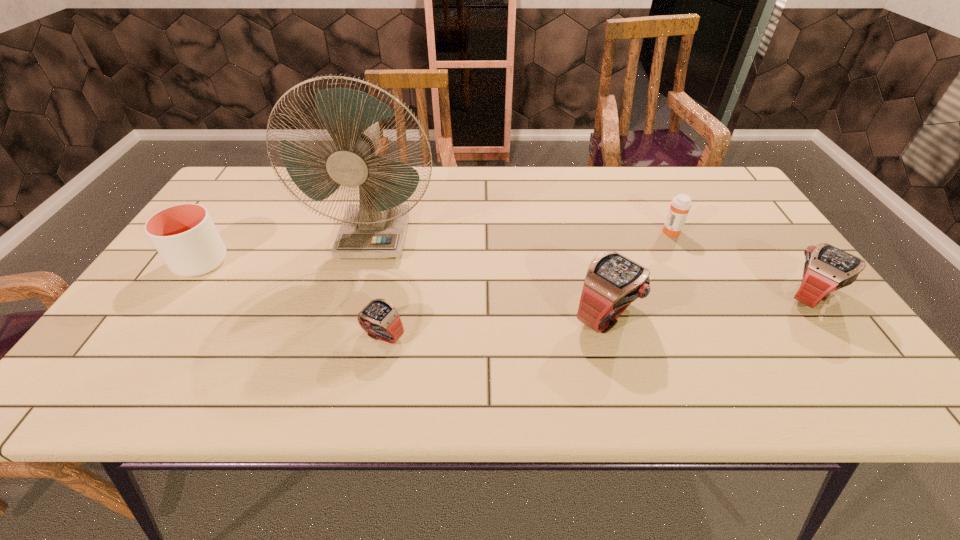
Given the evenly spaced watchs in the image, where should an extra watch be added on the left to preserve the spacing? Please point to a vacant space. Please provide its 2D coordinates. Your answer should be formatted as a tuple, i.e. [(x, y)], where the tuple contains the x and y coordinates of a point satisfying the conditions above.

[(139, 358)]